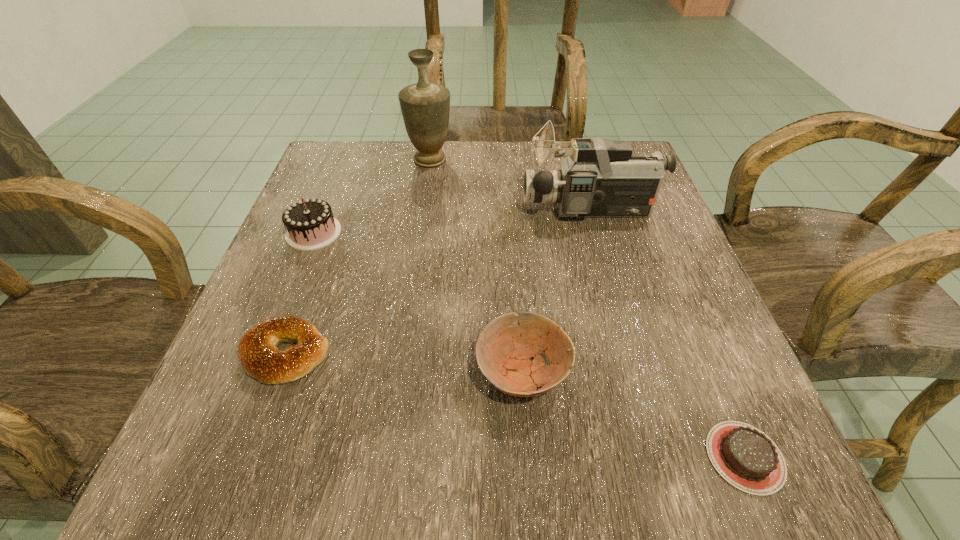
Where is `free location located on the front-facing side of the camcorder`? The image size is (960, 540). free location located on the front-facing side of the camcorder is located at coordinates (436, 210).

At what (x,y) coordinates should I click in order to perform the action: click on free space located on the front-facing side of the camcorder. Please return your answer as a coordinate pair (x, y). Looking at the image, I should click on (456, 210).

Identify the location of vacant region located 0.340m on the front-facing side of the camcorder. (359, 210).

The height and width of the screenshot is (540, 960). Identify the location of free space located on the back of the left chocolate cake. (349, 143).

The height and width of the screenshot is (540, 960). I want to click on vacant space located 0.170m on the left of the fourth tallest object, so click(359, 373).

The width and height of the screenshot is (960, 540). What are the coordinates of `vacant region located 0.070m on the right of the bagel` in the screenshot? It's located at (375, 353).

The height and width of the screenshot is (540, 960). What are the coordinates of `vacant space positioned on the left of the right chocolate cake` in the screenshot? It's located at (510, 457).

Locate an element on the screen. urn that is at the far edge is located at coordinates click(425, 107).

Find the location of a particular element. The image size is (960, 540). camcorder that is at the far edge is located at coordinates (601, 178).

This screenshot has width=960, height=540. I want to click on object located in the near edge section of the desktop, so click(x=744, y=456).